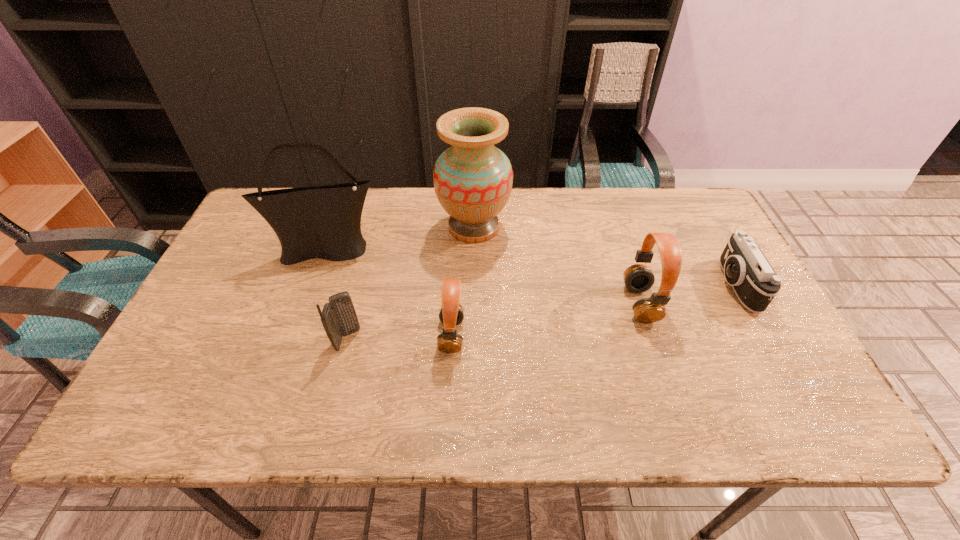
Image resolution: width=960 pixels, height=540 pixels. Identify the location of object identified as the fifth closest to the cellular telephone. [x=755, y=283].

Identify the location of blank space that satisfies the following two spatial constraints: 1. on the front side of the vase; 2. on the ear cups of the left headset. (472, 335).